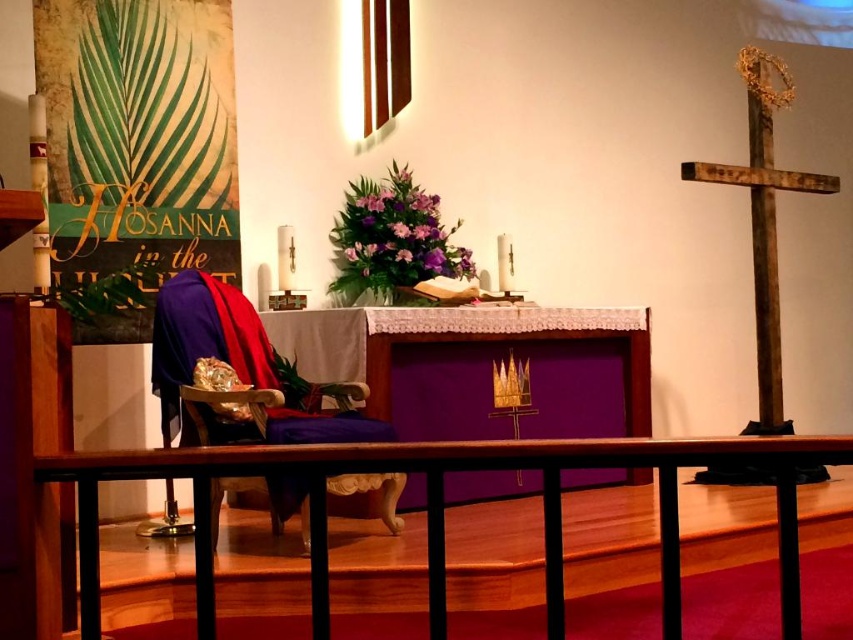
Is purple velvet chair at center further to camera compared to wooden cross at right?

No, purple velvet chair at center is closer to the viewer.

Between point (213, 492) and point (772, 301), which one is positioned behind?

The point (772, 301) is behind.

Where is `purple velvet chair at center`? The height and width of the screenshot is (640, 853). purple velvet chair at center is located at coordinates (238, 371).

Identify the location of brown wooden rail at lower center. This screenshot has height=640, width=853. (444, 506).

Is point (799, 620) positioned behind point (247, 422)?

No, (799, 620) is closer to viewer.

Between point (786, 609) and point (393, 525), which one is positioned in front?

Point (786, 609) is more forward.

Identify the location of brown wooden rail at lower center. (444, 506).

How distant is brown wooden rail at lower center from wooden cross at right?

The distance of brown wooden rail at lower center from wooden cross at right is 3.26 meters.

What do you see at coordinates (444, 506) in the screenshot?
I see `brown wooden rail at lower center` at bounding box center [444, 506].

Identify the location of brown wooden rail at lower center. (444, 506).

Locate an element on the screen. This screenshot has width=853, height=640. brown wooden rail at lower center is located at coordinates (444, 506).